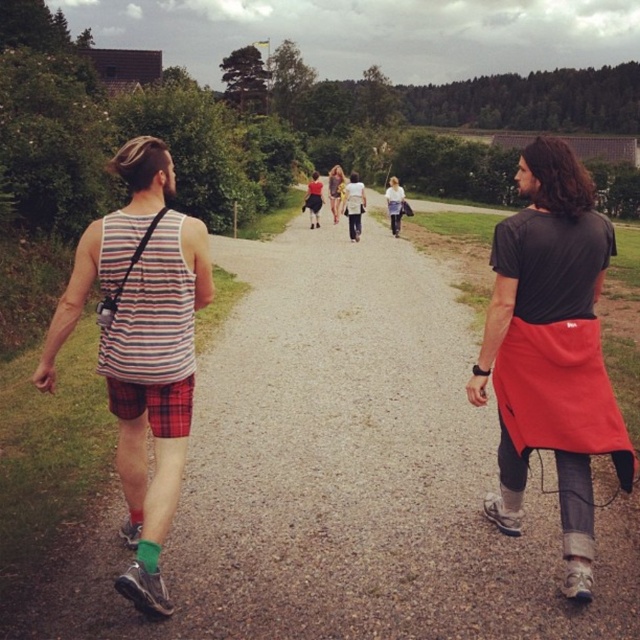
You are a photographer trying to capture a clear shot of both the red fabric apron at right and the striped fabric tank top at left. Since you want both subjects to be in focus, which one should you adjust your camera focus on first?

The red fabric apron at right is closer to you than the striped fabric tank top at left, so you should focus on the red fabric apron at right first to ensure both are in focus.